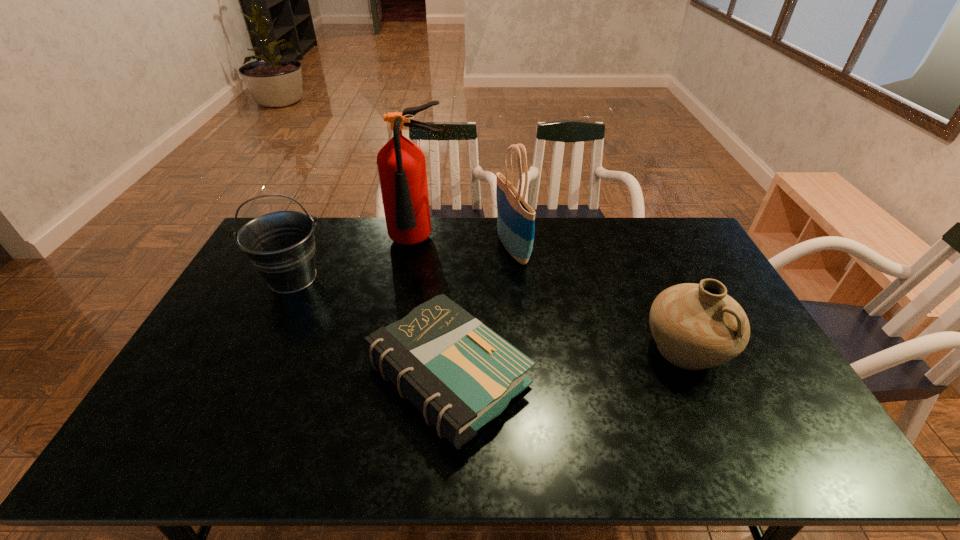
The width and height of the screenshot is (960, 540). In the image, there is a desktop. What are the coordinates of `vacant region at the right edge` in the screenshot? It's located at (695, 276).

The width and height of the screenshot is (960, 540). What are the coordinates of `free location at the far right corner` in the screenshot? It's located at (694, 234).

Find the location of a particular element. The width and height of the screenshot is (960, 540). vacant space in between the tote bag and the pottery is located at coordinates (599, 299).

Find the location of `free space between the leftmost object and the tote bag`. free space between the leftmost object and the tote bag is located at coordinates (402, 263).

Where is `free point between the leftmost object and the second shortest object`? free point between the leftmost object and the second shortest object is located at coordinates (490, 314).

Locate an element on the screen. This screenshot has height=540, width=960. blank region between the fourth shortest object and the rightmost object is located at coordinates (599, 299).

Find the location of `vacant point located between the pottery and the leftmost object`. vacant point located between the pottery and the leftmost object is located at coordinates (490, 314).

The height and width of the screenshot is (540, 960). Identify the location of vacant region between the third shortest object and the paperback book. (371, 327).

Locate an element on the screen. unoccupied area between the fire extinguisher and the bucket is located at coordinates (355, 261).

Locate an element on the screen. free spot between the second tallest object and the fire extinguisher is located at coordinates (465, 246).